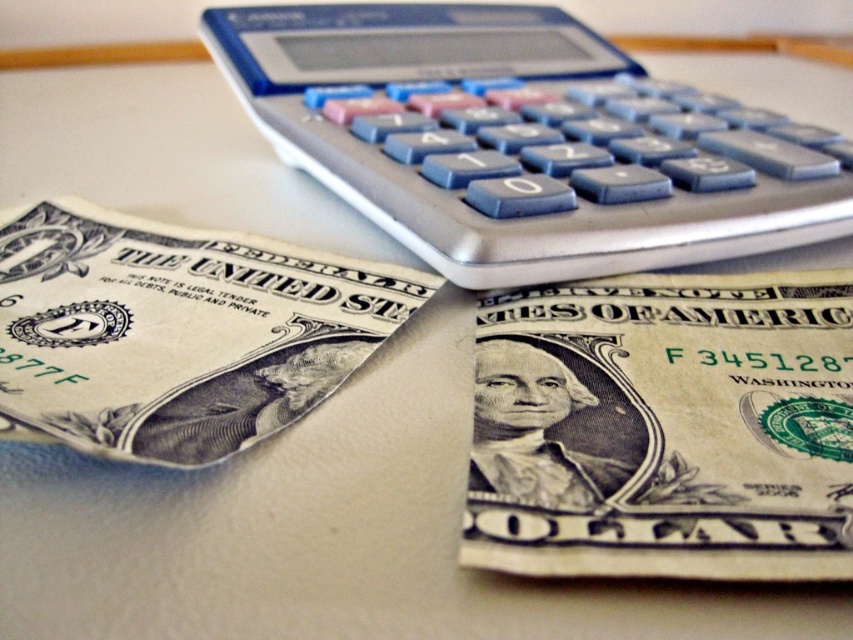
Which of these two, silver/blue plastic calculator at upper center or beige paper money at center, stands taller?

With more height is silver/blue plastic calculator at upper center.

Between point (497, 170) and point (799, 388), which one is positioned in front?

Positioned in front is point (799, 388).

Find the location of `silver/blue plastic calculator at upper center`. silver/blue plastic calculator at upper center is located at coordinates (523, 140).

Does beige paper money at center have a larger size compared to gray paper currency at center?

No.

Can you confirm if beige paper money at center is wider than gray paper currency at center?

Incorrect, beige paper money at center's width does not surpass gray paper currency at center's.

Locate an element on the screen. beige paper money at center is located at coordinates (664, 428).

Can you confirm if silver/blue plastic calculator at upper center is positioned to the right of gray paper currency at center?

Indeed, silver/blue plastic calculator at upper center is positioned on the right side of gray paper currency at center.

Who is shorter, silver/blue plastic calculator at upper center or gray paper currency at center?

gray paper currency at center is shorter.

The height and width of the screenshot is (640, 853). I want to click on silver/blue plastic calculator at upper center, so click(x=523, y=140).

Where is `silver/blue plastic calculator at upper center`? silver/blue plastic calculator at upper center is located at coordinates tap(523, 140).